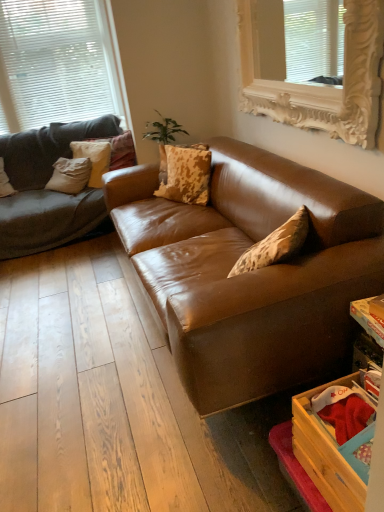
Where is `textured beige pillow at left, which is the 3th pillow from right to left`? The height and width of the screenshot is (512, 384). textured beige pillow at left, which is the 3th pillow from right to left is located at coordinates (93, 158).

The width and height of the screenshot is (384, 512). What do you see at coordinates (120, 150) in the screenshot?
I see `white textured pillow at upper left, positioned as the second pillow in right-to-left order` at bounding box center [120, 150].

What is the approximate height of white matte window at upper left, which appears as the first window when viewed from the left?

white matte window at upper left, which appears as the first window when viewed from the left, is 1.12 meters tall.

What do you see at coordinates (187, 174) in the screenshot?
I see `leopard print fabric pillow at center, marked as the 4th pillow in a left-to-right arrangement` at bounding box center [187, 174].

Describe the element at coordinates (5, 182) in the screenshot. The width and height of the screenshot is (384, 512). I see `matte gray pillow at left, the fourth pillow when ordered from right to left` at that location.

Where is `textured beige pillow at left, marked as the second pillow in a left-to-right arrangement`? textured beige pillow at left, marked as the second pillow in a left-to-right arrangement is located at coordinates (93, 158).

The height and width of the screenshot is (512, 384). I want to click on window that is behind the leopard print fabric pillow at center, marked as the 4th pillow in a left-to-right arrangement, so click(x=59, y=62).

Which object is thinner, leopard print fabric pillow at center, which is counted as the 1th pillow, starting from the right, or white matte window at upper left, the second window when ordered from right to left?

leopard print fabric pillow at center, which is counted as the 1th pillow, starting from the right.

Looking at this image, how many degrees apart are the facing directions of leopard print fabric pillow at center, which is counted as the 1th pillow, starting from the right, and white matte window at upper left, which appears as the first window when viewed from the left?

The angle between the facing direction of leopard print fabric pillow at center, which is counted as the 1th pillow, starting from the right, and the facing direction of white matte window at upper left, which appears as the first window when viewed from the left, is 57.5 degrees.

From a real-world perspective, between leopard print fabric pillow at center, marked as the 4th pillow in a left-to-right arrangement, and white matte window at upper left, the second window when ordered from right to left, who is vertically higher?

From a 3D spatial view, white matte window at upper left, the second window when ordered from right to left, is above.

Which object is more forward, leopard print fabric pillow at center, which is counted as the 1th pillow, starting from the right, or matte gray pillow at left, the fourth pillow when ordered from right to left?

leopard print fabric pillow at center, which is counted as the 1th pillow, starting from the right, is closer to the camera.

Which is more to the left, leopard print fabric pillow at center, which is counted as the 1th pillow, starting from the right, or matte gray pillow at left, which ranks as the first pillow in left-to-right order?

Positioned to the left is matte gray pillow at left, which ranks as the first pillow in left-to-right order.

From the image's perspective, is leopard print fabric pillow at center, which is counted as the 1th pillow, starting from the right, located above or below matte gray pillow at left, which ranks as the first pillow in left-to-right order?

leopard print fabric pillow at center, which is counted as the 1th pillow, starting from the right, is situated lower than matte gray pillow at left, which ranks as the first pillow in left-to-right order, in the image.

Based on the photo, from a real-world perspective, is leopard print fabric pillow at center, which is counted as the 1th pillow, starting from the right, physically below matte gray pillow at left, the fourth pillow when ordered from right to left?

No, from a real-world perspective, leopard print fabric pillow at center, which is counted as the 1th pillow, starting from the right, is not under matte gray pillow at left, the fourth pillow when ordered from right to left.

From a real-world perspective, is leopard print fabric pillow at center, marked as the 4th pillow in a left-to-right arrangement, physically located above or below brown leather couch at center?

In terms of real-world spatial position, leopard print fabric pillow at center, marked as the 4th pillow in a left-to-right arrangement, is above brown leather couch at center.

Considering the points (188, 162) and (344, 341), which point is in front, point (188, 162) or point (344, 341)?

Positioned in front is point (344, 341).

In terms of size, does leopard print fabric pillow at center, which is counted as the 1th pillow, starting from the right, appear bigger or smaller than brown leather couch at center?

In the image, leopard print fabric pillow at center, which is counted as the 1th pillow, starting from the right, appears to be smaller than brown leather couch at center.

Who is taller, leopard print fabric pillow at center, marked as the 4th pillow in a left-to-right arrangement, or brown leather couch at center?

brown leather couch at center is taller.

From the image's perspective, does textured beige pillow at left, marked as the second pillow in a left-to-right arrangement, appear lower than white textured pillow at upper left, positioned as the second pillow in right-to-left order?

Yes, from the image's perspective, textured beige pillow at left, marked as the second pillow in a left-to-right arrangement, is below white textured pillow at upper left, positioned as the second pillow in right-to-left order.

Is textured beige pillow at left, marked as the second pillow in a left-to-right arrangement, facing towards white textured pillow at upper left, the 3th pillow when ordered from left to right?

Yes.

Between point (93, 149) and point (122, 150), which one is positioned behind?

The point (122, 150) is farther.

Is textured beige pillow at left, which is the 3th pillow from right to left, directly adjacent to white textured pillow at upper left, positioned as the second pillow in right-to-left order?

textured beige pillow at left, which is the 3th pillow from right to left, and white textured pillow at upper left, positioned as the second pillow in right-to-left order, are not in contact.

Is matte gray pillow at left, which ranks as the first pillow in left-to-right order, positioned with its back to textured beige pillow at left, marked as the second pillow in a left-to-right arrangement?

No, textured beige pillow at left, marked as the second pillow in a left-to-right arrangement, is not at the back of matte gray pillow at left, which ranks as the first pillow in left-to-right order.

The image size is (384, 512). Find the location of `pillow that is the 1st one when counting rightward from the matte gray pillow at left, the fourth pillow when ordered from right to left`. pillow that is the 1st one when counting rightward from the matte gray pillow at left, the fourth pillow when ordered from right to left is located at coordinates (93, 158).

Does matte gray pillow at left, which ranks as the first pillow in left-to-right order, have a lesser height compared to textured beige pillow at left, marked as the second pillow in a left-to-right arrangement?

Yes, matte gray pillow at left, which ranks as the first pillow in left-to-right order, is shorter than textured beige pillow at left, marked as the second pillow in a left-to-right arrangement.

Is the surface of matte gray pillow at left, which ranks as the first pillow in left-to-right order, in direct contact with textured beige pillow at left, marked as the second pillow in a left-to-right arrangement?

matte gray pillow at left, which ranks as the first pillow in left-to-right order, and textured beige pillow at left, marked as the second pillow in a left-to-right arrangement, are clearly separated.

How many degrees apart are the facing directions of white matte window at upper left, which is the first window from back to front, and brown leather couch at center?

They differ by 89.3 degrees in their facing directions.

Is white matte window at upper left, which appears as the first window when viewed from the left, directly adjacent to brown leather couch at center?

No, white matte window at upper left, which appears as the first window when viewed from the left, is not with brown leather couch at center.

Could brown leather couch at center be considered to be inside white matte window at upper left, which appears as the first window when viewed from the left?

No, brown leather couch at center is not a part of white matte window at upper left, which appears as the first window when viewed from the left.

Which is behind, point (30, 61) or point (212, 165)?

The point (30, 61) is farther.

From the image's perspective, which object appears higher, matte gray pillow at left, which ranks as the first pillow in left-to-right order, or white matte window at upper left, which is the first window from back to front?

white matte window at upper left, which is the first window from back to front, appears higher in the image.

In the image, is matte gray pillow at left, the fourth pillow when ordered from right to left, positioned in front of or behind white matte window at upper left, the second window when ordered from right to left?

matte gray pillow at left, the fourth pillow when ordered from right to left, is in front of white matte window at upper left, the second window when ordered from right to left.

Which of these two, matte gray pillow at left, which ranks as the first pillow in left-to-right order, or white matte window at upper left, which is the first window from back to front, stands taller?

white matte window at upper left, which is the first window from back to front.

Which is more to the right, matte gray pillow at left, which ranks as the first pillow in left-to-right order, or white matte window at upper left, which appears as the first window when viewed from the left?

From the viewer's perspective, white matte window at upper left, which appears as the first window when viewed from the left, appears more on the right side.

From a real-world perspective, starting from the leopard print fabric pillow at center, marked as the 4th pillow in a left-to-right arrangement, which window is the 2nd one vertically above it? Please provide its 2D coordinates.

[(59, 62)]

This screenshot has width=384, height=512. What are the coordinates of `the 1st pillow behind when counting from the leopard print fabric pillow at center, which is counted as the 1th pillow, starting from the right` in the screenshot? It's located at (5, 182).

When comparing their distances from textured beige pillow at left, which is the 3th pillow from right to left, does wooden crate at lower right or white matte window at upper left, the second window when ordered from right to left, seem closer?

The object closer to textured beige pillow at left, which is the 3th pillow from right to left, is white matte window at upper left, the second window when ordered from right to left.

From the image, which object appears to be nearer to matte gray pillow at left, the fourth pillow when ordered from right to left, brown leather couch at center or leopard print fabric pillow at center, marked as the 4th pillow in a left-to-right arrangement?

Among the two, leopard print fabric pillow at center, marked as the 4th pillow in a left-to-right arrangement, is located nearer to matte gray pillow at left, the fourth pillow when ordered from right to left.

Estimate the real-world distances between objects in this image. Which object is further from leopard print fabric pillow at center, which is counted as the 1th pillow, starting from the right, matte gray pillow at left, the fourth pillow when ordered from right to left, or white textured pillow at upper left, the 3th pillow when ordered from left to right?

matte gray pillow at left, the fourth pillow when ordered from right to left, lies further to leopard print fabric pillow at center, which is counted as the 1th pillow, starting from the right, than the other object.

In the scene shown: Considering their positions, is white matte window at upper left, which is the 2th window from front to back, positioned closer to wooden crate at lower right than leopard print fabric pillow at center, which is counted as the 1th pillow, starting from the right?

Based on the image, leopard print fabric pillow at center, which is counted as the 1th pillow, starting from the right, appears to be nearer to wooden crate at lower right.

Which object lies nearer to the anchor point wooden crate at lower right, white ornate frame at upper center, positioned as the first window in front-to-back order, or leopard print fabric pillow at center, marked as the 4th pillow in a left-to-right arrangement?

The object closer to wooden crate at lower right is white ornate frame at upper center, positioned as the first window in front-to-back order.

From the image, which object appears to be nearer to wooden crate at lower right, textured beige pillow at left, which is the 3th pillow from right to left, or white matte window at upper left, the second window when ordered from right to left?

The object closer to wooden crate at lower right is textured beige pillow at left, which is the 3th pillow from right to left.

From the image, which object appears to be farther from white matte window at upper left, the second window when ordered from right to left, white textured pillow at upper left, positioned as the second pillow in right-to-left order, or textured beige pillow at left, which is the 3th pillow from right to left?

The object further to white matte window at upper left, the second window when ordered from right to left, is white textured pillow at upper left, positioned as the second pillow in right-to-left order.

Estimate the real-world distances between objects in this image. Which object is further from white matte window at upper left, which appears as the first window when viewed from the left, matte gray pillow at left, which ranks as the first pillow in left-to-right order, or wooden crate at lower right?

wooden crate at lower right is positioned further to the anchor white matte window at upper left, which appears as the first window when viewed from the left.

Locate an element on the screen. The width and height of the screenshot is (384, 512). window located between wooden crate at lower right and textured beige pillow at left, marked as the second pillow in a left-to-right arrangement, in the depth direction is located at coordinates (314, 86).

Where is `pillow positioned between wooden crate at lower right and matte gray pillow at left, which ranks as the first pillow in left-to-right order, from near to far`? The height and width of the screenshot is (512, 384). pillow positioned between wooden crate at lower right and matte gray pillow at left, which ranks as the first pillow in left-to-right order, from near to far is located at coordinates (187, 174).

This screenshot has width=384, height=512. I want to click on studio couch positioned between wooden crate at lower right and white textured pillow at upper left, positioned as the second pillow in right-to-left order, from near to far, so click(x=251, y=272).

The image size is (384, 512). Identify the location of window between matte gray pillow at left, the fourth pillow when ordered from right to left, and white ornate frame at upper center, which ranks as the first window in right-to-left order, in the horizontal direction. (59, 62).